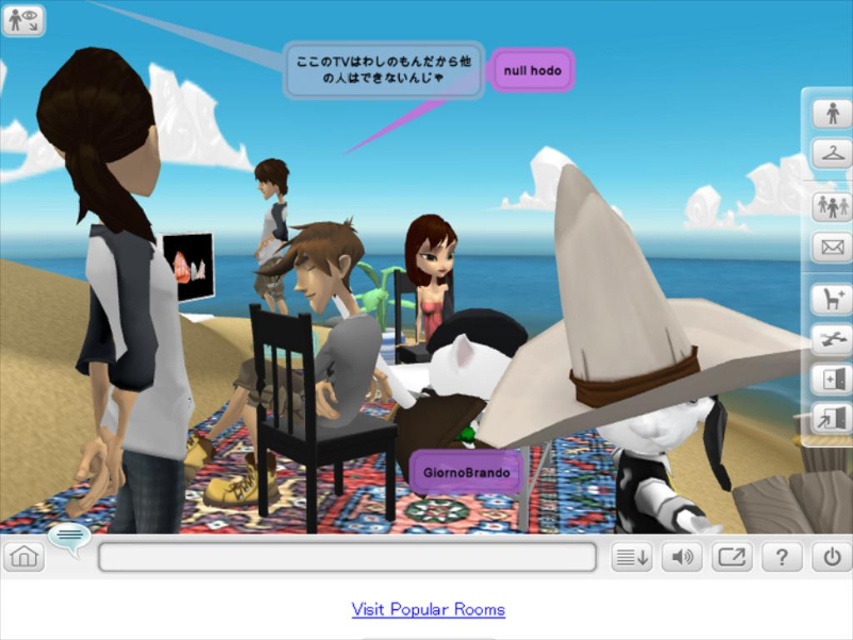
Between point (126, 141) and point (265, 280), which one is positioned behind?

The point (265, 280) is behind.

Is white matte dress at left smaller than light brown fabric shirt at center?

Yes, white matte dress at left is smaller than light brown fabric shirt at center.

Does point (93, 211) come farther from viewer compared to point (257, 170)?

No.

This screenshot has height=640, width=853. I want to click on white matte dress at left, so click(x=122, y=291).

Can you confirm if matte gray shirt at center is thinner than light brown fabric shirt at center?

No, matte gray shirt at center is not thinner than light brown fabric shirt at center.

Does matte gray shirt at center lie behind light brown fabric shirt at center?

No.

Does point (270, 378) come behind point (268, 234)?

No, it is in front of (268, 234).

Locate an element on the screen. The width and height of the screenshot is (853, 640). matte gray shirt at center is located at coordinates (338, 321).

Is white matte dress at left wider than matte gray shirt at center?

In fact, white matte dress at left might be narrower than matte gray shirt at center.

Who is shorter, white matte dress at left or matte gray shirt at center?

white matte dress at left

Is point (115, 529) farther from viewer compared to point (347, 269)?

No, (115, 529) is closer to viewer.

The width and height of the screenshot is (853, 640). I want to click on white matte dress at left, so click(122, 291).